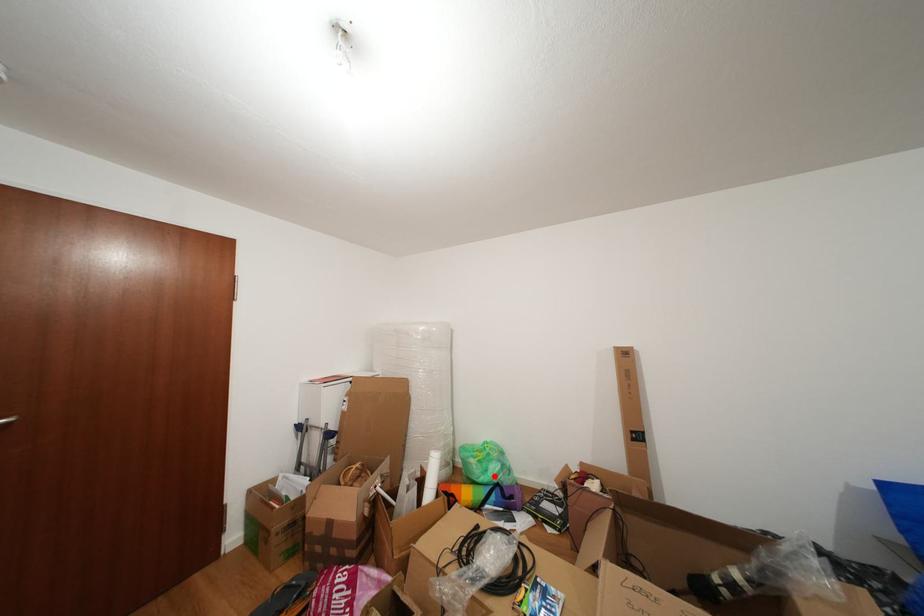
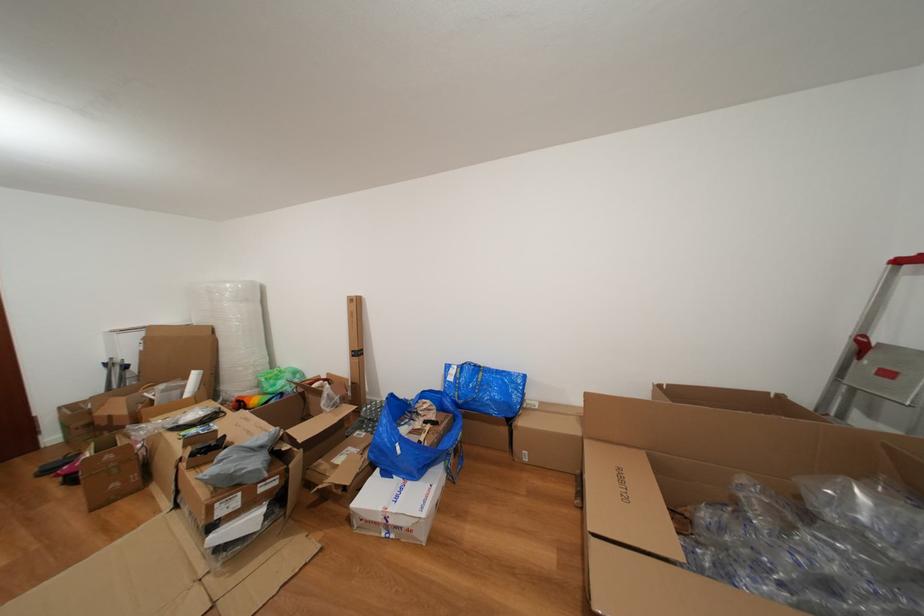
Question: I am providing you with two images of the same scene from different viewpoints. Given a red point in image1, look at the same physical point in image2. Is it:

Choices:
 (A) Closer to the viewpoint
 (B) Farther from the viewpoint

Answer: (A)